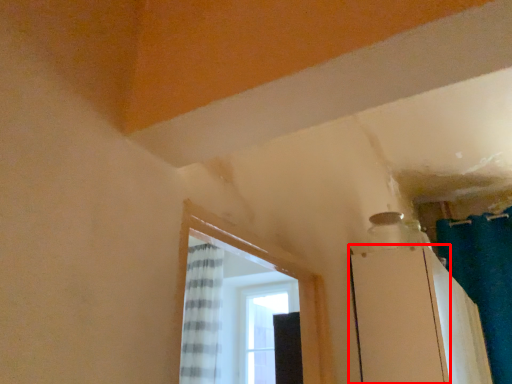
Question: From the image's perspective, considering the relative positions of screen door (annotated by the red box) and shower curtain in the image provided, where is screen door (annotated by the red box) located with respect to the staircase?

Choices:
 (A) below
 (B) above

Answer: (A)